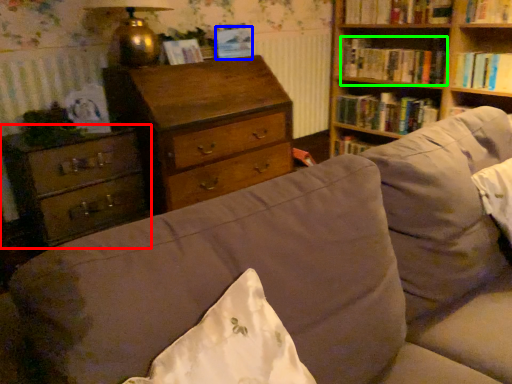
Question: Which object is the farthest from chest of drawers (highlighted by a red box)? Choose among these: paperback book (highlighted by a blue box) or book (highlighted by a green box).

Choices:
 (A) paperback book
 (B) book

Answer: (B)